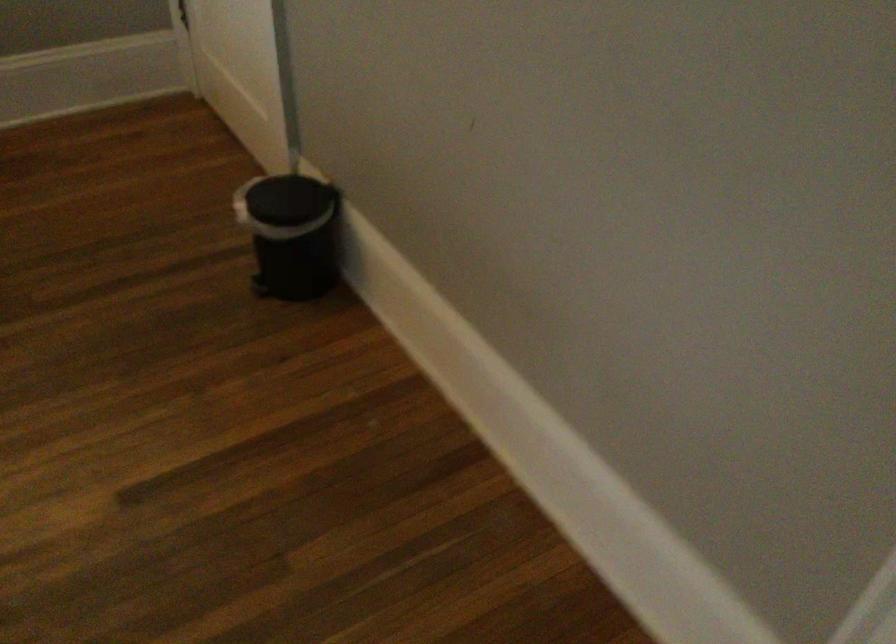
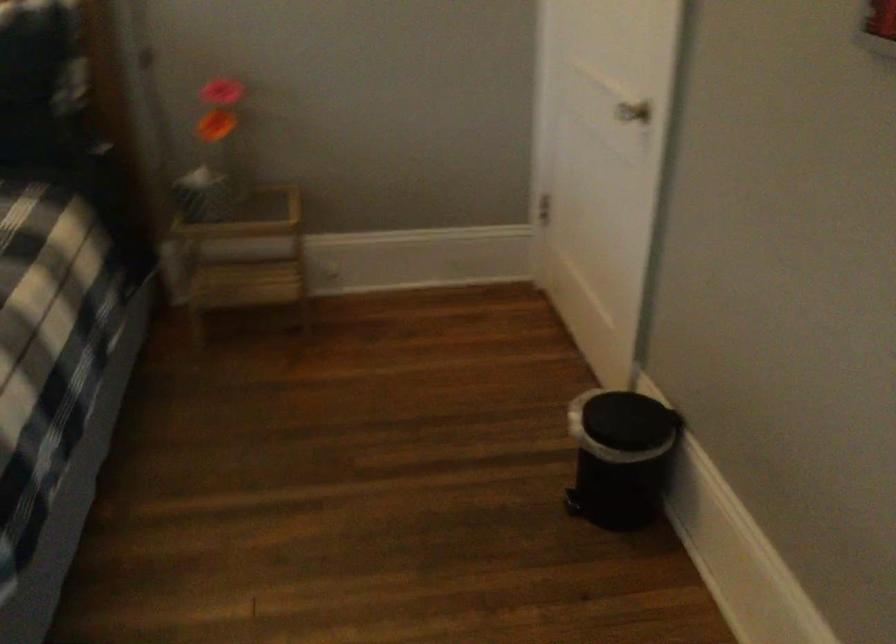
Find the pixel in the second image that matches (263,279) in the first image.

(573, 504)